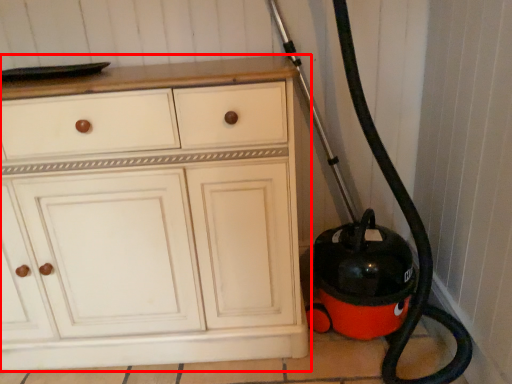
Question: In this image, where is chest of drawers (annotated by the red box) located relative to garden hose?

Choices:
 (A) left
 (B) right

Answer: (A)